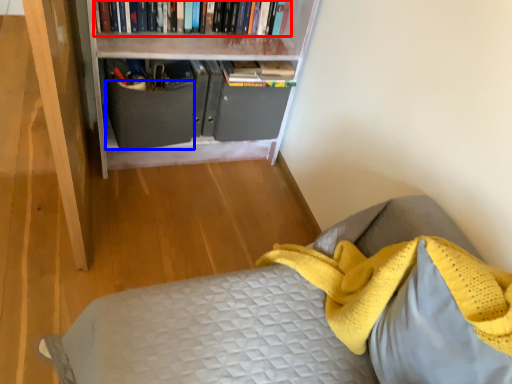
Question: Which object is closer to the camera taking this photo, book (highlighted by a red box) or drawer (highlighted by a blue box)?

Choices:
 (A) book
 (B) drawer

Answer: (A)